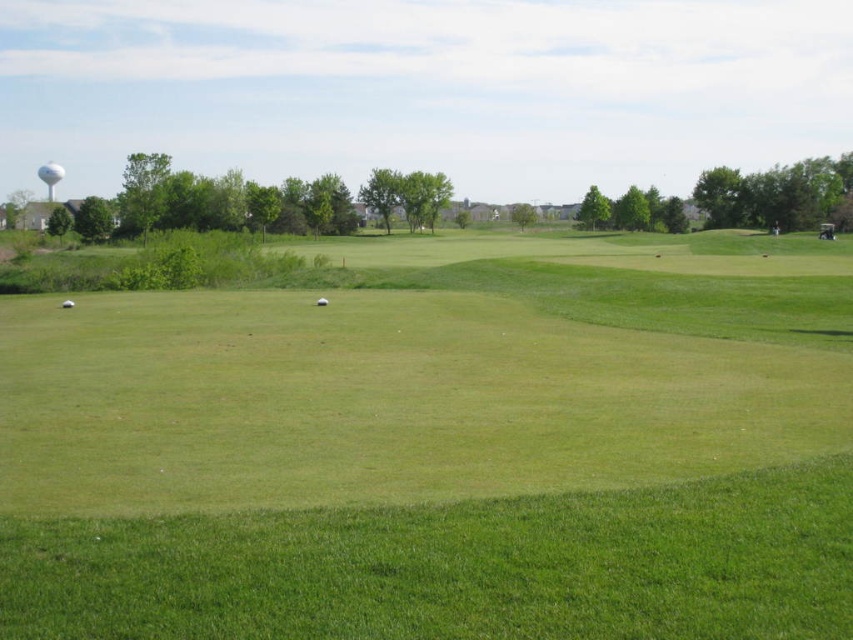
Is white matte golf ball at lower left smaller than white matte golf ball at center?

Incorrect, white matte golf ball at lower left is not smaller in size than white matte golf ball at center.

Between point (68, 300) and point (318, 298), which one is positioned in front?

Point (318, 298) is in front.

Between point (61, 305) and point (320, 300), which one is positioned in front?

Point (320, 300) is more forward.

In order to click on white matte golf ball at lower left in this screenshot , I will do `click(67, 304)`.

Is green grassy field at center below white matte golf ball at center?

Actually, green grassy field at center is above white matte golf ball at center.

Who is lower down, green grassy field at center or white matte golf ball at center?

Positioned lower is white matte golf ball at center.

You are a GUI agent. You are given a task and a screenshot of the screen. Output one action in this format:
    pyautogui.click(x=<x>, y=<y>)
    Task: Click on the green grassy field at center
    The height and width of the screenshot is (640, 853).
    Given the screenshot: What is the action you would take?
    pyautogui.click(x=440, y=445)

Between point (466, 608) and point (73, 305), which one is positioned in front?

Point (466, 608) is in front.

Who is higher up, green grassy field at center or white matte golf ball at lower left?

green grassy field at center

Who is more forward, (90, 570) or (64, 301)?

Positioned in front is point (90, 570).

Find the location of a particular element. The height and width of the screenshot is (640, 853). green grassy field at center is located at coordinates (440, 445).